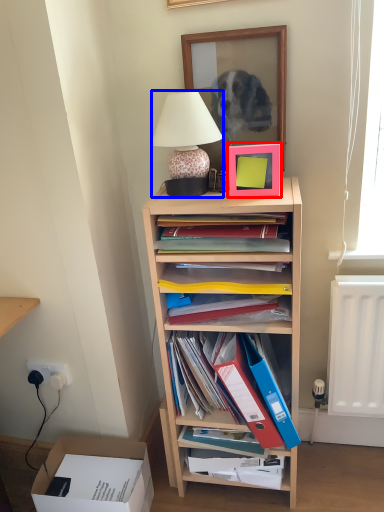
Question: Which object appears closest to the camera in this image, picture frame (highlighted by a red box) or lamp (highlighted by a blue box)?

Choices:
 (A) picture frame
 (B) lamp

Answer: (B)